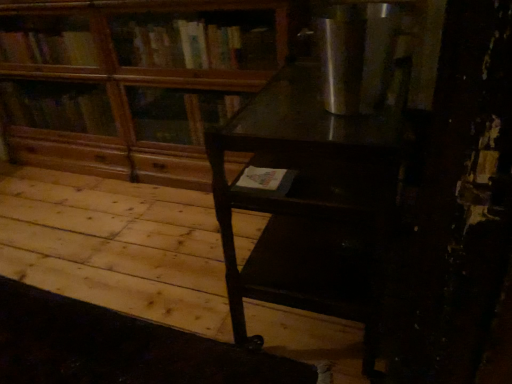
What do you see at coordinates (131, 81) in the screenshot? This screenshot has width=512, height=384. I see `wooden bookcase at center` at bounding box center [131, 81].

In order to face wooden bookcase at center, should I rotate leftwards or rightwards?

Rotate your view left by about 16.877°.

The height and width of the screenshot is (384, 512). Find the location of `wooden bookcase at center`. wooden bookcase at center is located at coordinates (131, 81).

Locate an element on the screen. This screenshot has height=384, width=512. dark wood table at center is located at coordinates (312, 201).

What do you see at coordinates (312, 201) in the screenshot?
I see `dark wood table at center` at bounding box center [312, 201].

This screenshot has width=512, height=384. What are the coordinates of `wooden bookcase at center` in the screenshot? It's located at (131, 81).

Between dark wood table at center and wooden bookcase at center, which one appears on the right side from the viewer's perspective?

Positioned to the right is dark wood table at center.

In the scene shown: Between dark wood table at center and wooden bookcase at center, which one is positioned behind?

wooden bookcase at center.

Which is in front, point (303, 93) or point (280, 11)?

The point (303, 93) is in front.

In the scene shown: From the image's perspective, is dark wood table at center located above wooden bookcase at center?

No.

From a real-world perspective, who is located higher, dark wood table at center or wooden bookcase at center?

From a 3D spatial view, wooden bookcase at center is above.

Which of these two, dark wood table at center or wooden bookcase at center, is wider?

With larger width is dark wood table at center.

In terms of height, does dark wood table at center look taller or shorter compared to wooden bookcase at center?

In the image, dark wood table at center appears to be shorter than wooden bookcase at center.

In terms of size, does dark wood table at center appear bigger or smaller than wooden bookcase at center?

In the image, dark wood table at center appears to be smaller than wooden bookcase at center.

In the scene shown: Would you say dark wood table at center is outside wooden bookcase at center?

Yes, dark wood table at center is not within wooden bookcase at center.

Can you see dark wood table at center touching wooden bookcase at center?

dark wood table at center and wooden bookcase at center are clearly separated.

Is wooden bookcase at center at the back of dark wood table at center?

dark wood table at center does not have its back to wooden bookcase at center.

Can you tell me how much dark wood table at center and wooden bookcase at center differ in facing direction?

dark wood table at center and wooden bookcase at center are facing 91.3 degrees away from each other.

Where is `table located below the wooden bookcase at center (from the image's perspective)`? This screenshot has width=512, height=384. table located below the wooden bookcase at center (from the image's perspective) is located at coordinates (312, 201).

Which is more to the right, wooden bookcase at center or dark wood table at center?

dark wood table at center.

Which object is further away from the camera taking this photo, wooden bookcase at center or dark wood table at center?

wooden bookcase at center is behind.

Does point (190, 73) appear closer or farther from the camera than point (365, 161)?

Point (190, 73) appears to be farther away from the viewer than point (365, 161).

From the image's perspective, is wooden bookcase at center above or below dark wood table at center?

wooden bookcase at center is situated higher than dark wood table at center in the image.

From a real-world perspective, is wooden bookcase at center positioned over dark wood table at center based on gravity?

Correct, in the physical world, wooden bookcase at center is higher than dark wood table at center.

Which object is thinner, wooden bookcase at center or dark wood table at center?

With smaller width is wooden bookcase at center.

Considering the sizes of wooden bookcase at center and dark wood table at center in the image, is wooden bookcase at center taller or shorter than dark wood table at center?

In the image, wooden bookcase at center appears to be taller than dark wood table at center.

Which of these two, wooden bookcase at center or dark wood table at center, is smaller?

Smaller between the two is dark wood table at center.

Do you think wooden bookcase at center is within dark wood table at center, or outside of it?

wooden bookcase at center is not inside dark wood table at center, it's outside.

Would you say wooden bookcase at center is a long distance from dark wood table at center?

No, wooden bookcase at center is in close proximity to dark wood table at center.

In the scene shown: Is wooden bookcase at center looking in the opposite direction of dark wood table at center?

No, wooden bookcase at center is not facing the opposite direction of dark wood table at center.

Can you tell me how much wooden bookcase at center and dark wood table at center differ in facing direction?

The facing directions of wooden bookcase at center and dark wood table at center are 91.3 degrees apart.

You are a GUI agent. You are given a task and a screenshot of the screen. Output one action in this format:
    pyautogui.click(x=<x>, y=<y>)
    Task: Click on the table that appears in front of the wooden bookcase at center
    
    Given the screenshot: What is the action you would take?
    [x=312, y=201]

Locate an element on the screen. bookcase on the left of dark wood table at center is located at coordinates (131, 81).

This screenshot has width=512, height=384. I want to click on table lying in front of the wooden bookcase at center, so click(312, 201).